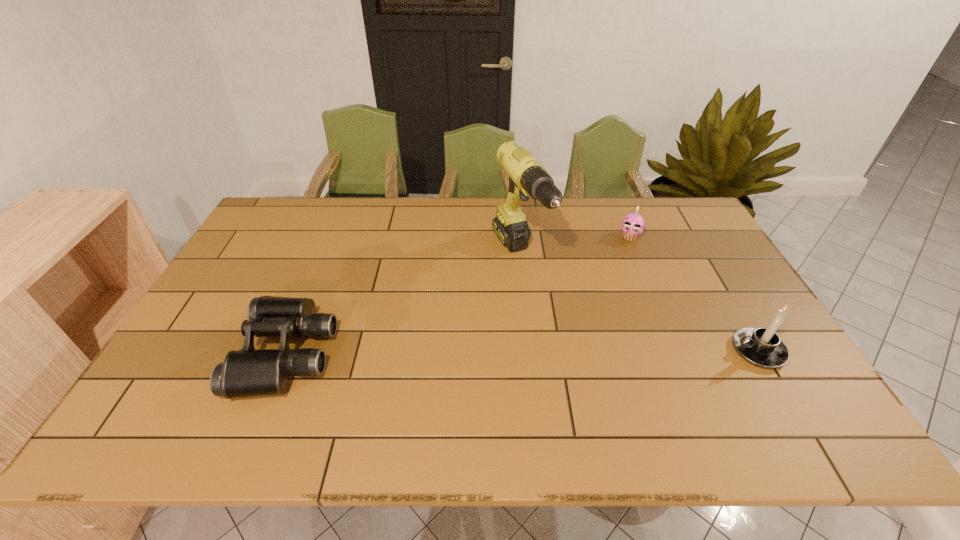
What are the coordinates of `object identified as the second closest to the second tallest object` in the screenshot? It's located at (527, 177).

I want to click on object that is the third closest one to the leftmost object, so pyautogui.click(x=762, y=347).

Find the location of a particular element. This screenshot has width=960, height=540. free space that satisfies the following two spatial constraints: 1. on the back side of the tallest object; 2. on the left side of the cupcake is located at coordinates (517, 237).

Locate an element on the screen. free region that satisfies the following two spatial constraints: 1. on the front side of the candle holder; 2. with a handle on the side of the cupcake is located at coordinates (678, 351).

Locate an element on the screen. vacant space that satisfies the following two spatial constraints: 1. on the front side of the second object from right to left; 2. with a handle on the side of the second tallest object is located at coordinates (678, 351).

At what (x,y) coordinates should I click in order to perform the action: click on free point that satisfies the following two spatial constraints: 1. on the front side of the drill; 2. with a handle on the side of the third shortest object. Please return your answer as a coordinate pair (x, y). This screenshot has height=540, width=960. Looking at the image, I should click on (530, 351).